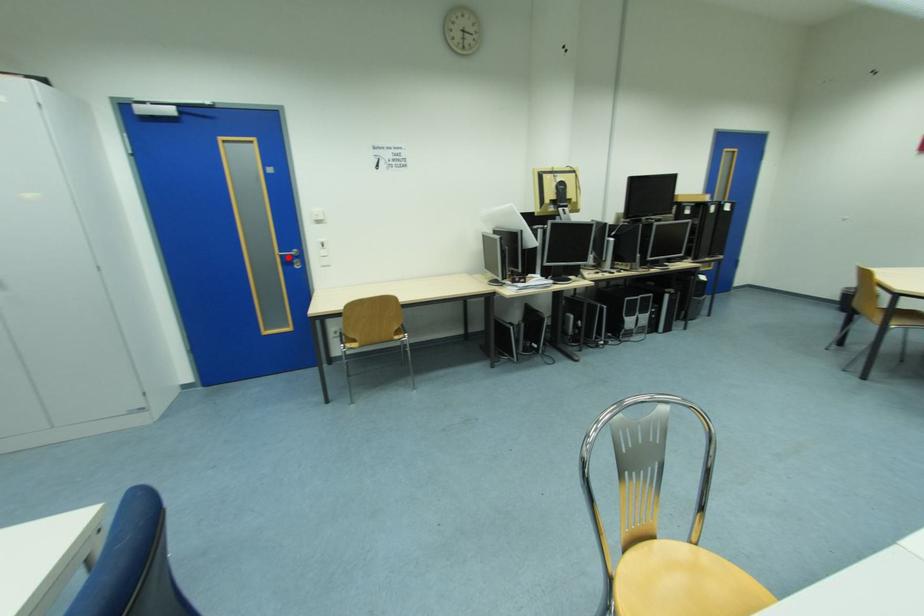
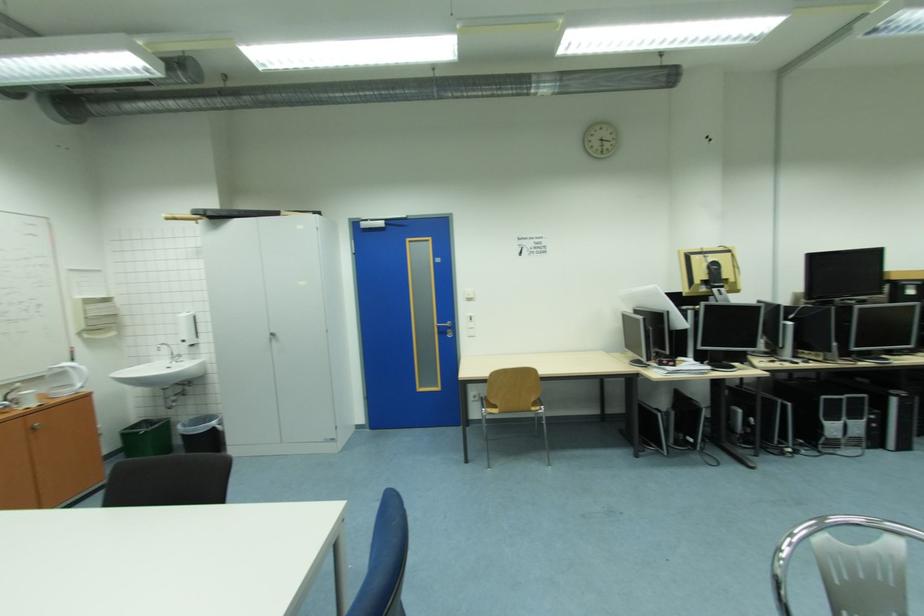
Question: I am providing you with two images of the same scene from different viewpoints. Image1 has a red point marked. In image2, the corresponding 3D location appears at what relative position? Reply with the corresponding letter.

Choices:
 (A) Closer
 (B) Farther

Answer: (B)